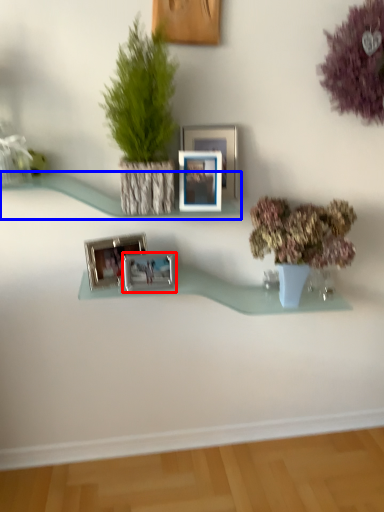
Question: Among these objects, which one is farthest to the camera, picture frame (highlighted by a red box) or shelf (highlighted by a blue box)?

Choices:
 (A) picture frame
 (B) shelf

Answer: (A)